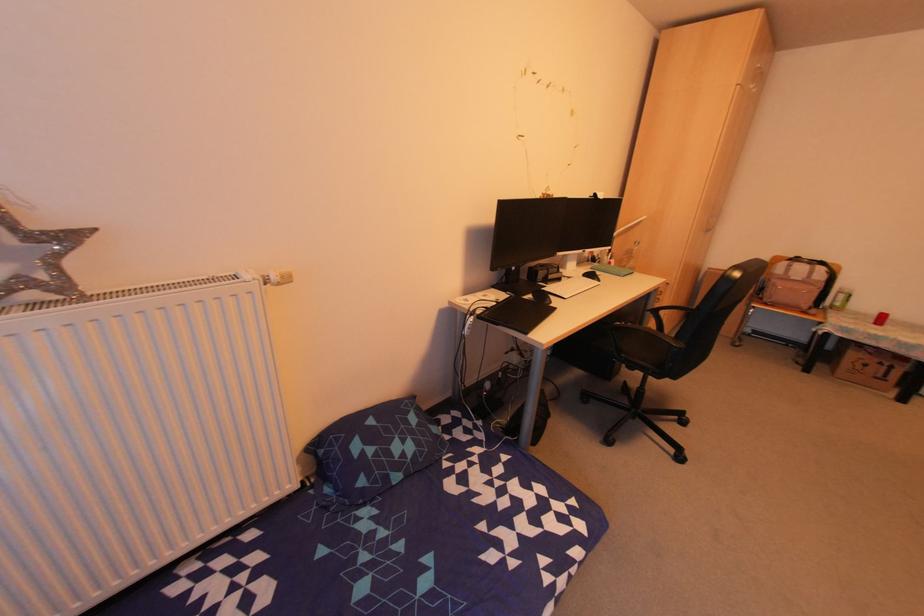
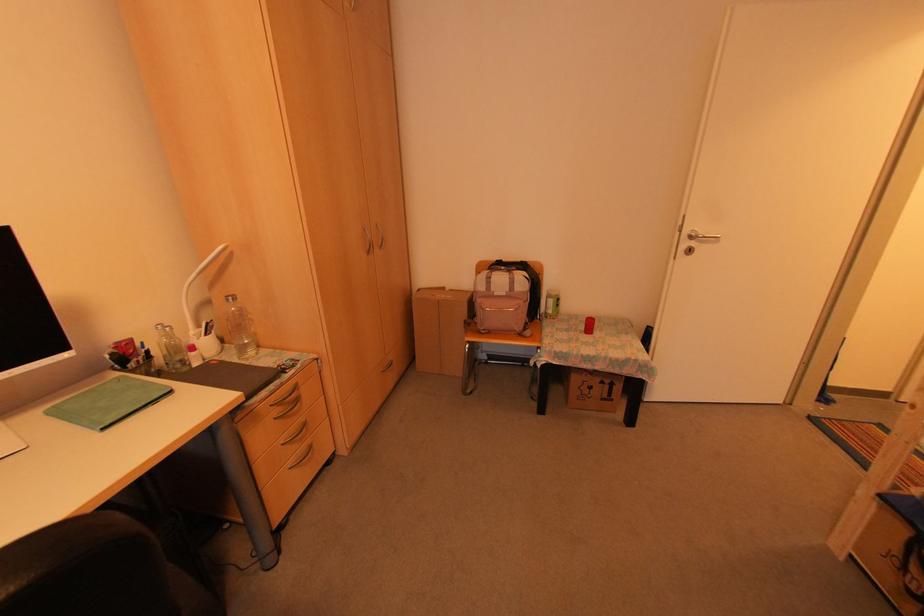
Find the pixel in the second image that matches pixel 830 306 in the first image.

(543, 314)